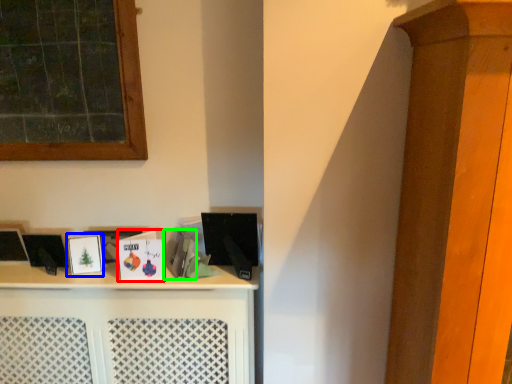
Question: Which object is positioned farthest from book (highlighted by a red box)? Select from picture frame (highlighted by a blue box) and book (highlighted by a green box).

Choices:
 (A) picture frame
 (B) book

Answer: (A)